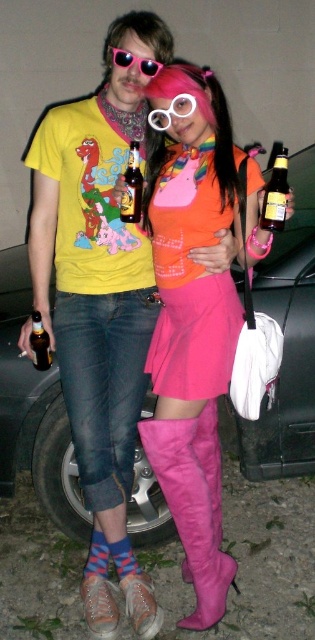
Question: Can you confirm if brown glass bottle at center is positioned to the left of pink rubber goggles at center?

Choices:
 (A) yes
 (B) no

Answer: (A)

Question: Which object is the closest to the pink suede boots at lower center?

Choices:
 (A) pink plastic goggles at upper center
 (B) translucent glass bottle at lower left
 (C) pink suede boot at lower center
 (D) brown glass bottle at center

Answer: (C)

Question: Estimate the real-world distances between objects in this image. Which object is closer to the pink plastic goggles at upper center?

Choices:
 (A) pink satin dress at center
 (B) translucent glass bottle at lower left
 (C) matte yellow t-shirt at center

Answer: (C)

Question: Observing the image, what is the correct spatial positioning of pink satin dress at center in reference to pink suede boot at lower center?

Choices:
 (A) right
 (B) left

Answer: (A)

Question: Which of the following is the closest to the observer?

Choices:
 (A) translucent glass bottle at lower left
 (B) pink satin dress at center

Answer: (B)

Question: Does matte yellow t-shirt at center appear on the right side of translucent glass bottle at lower left?

Choices:
 (A) yes
 (B) no

Answer: (A)